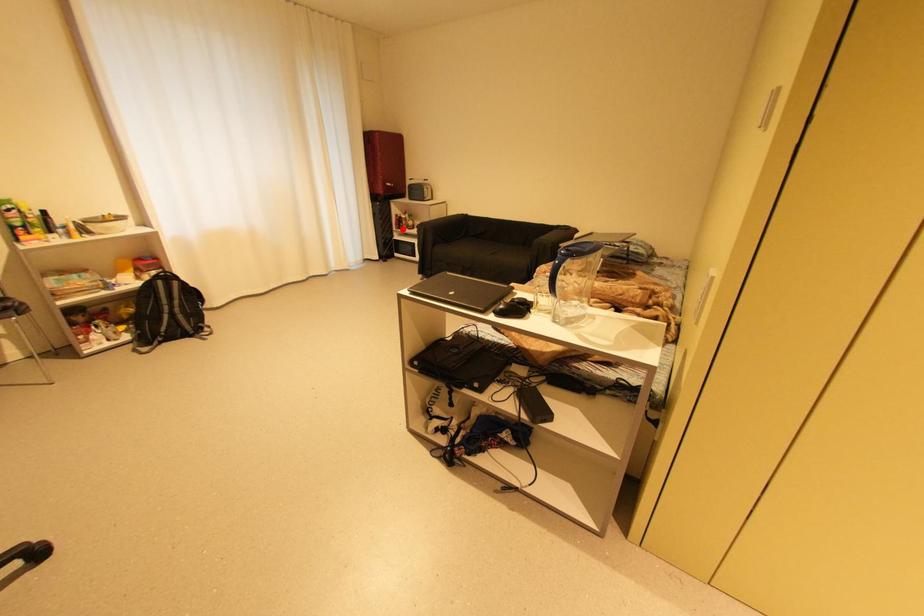
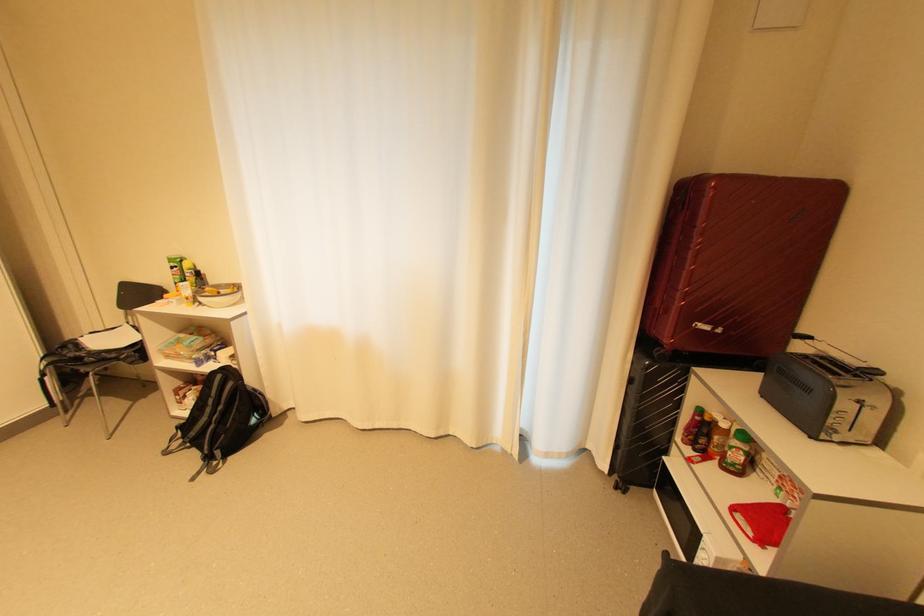
Question: I am providing you with two images of the same scene from different viewpoints. A red point is shown in image1. For the corresponding object point in image2, is it positioned nearer or farther from the camera?

Choices:
 (A) Nearer
 (B) Farther

Answer: (B)